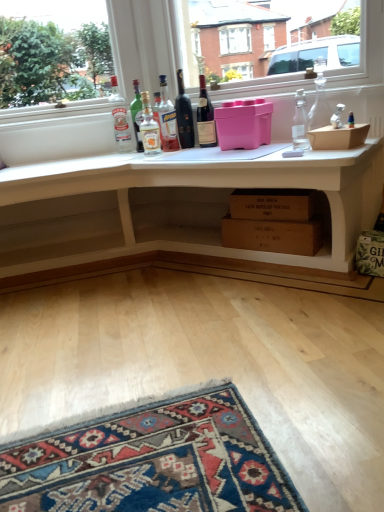
This screenshot has height=512, width=384. Identify the location of vacant region in front of clear glass bottle at upper right, arranged as the 2th bottle when viewed from the right. (308, 156).